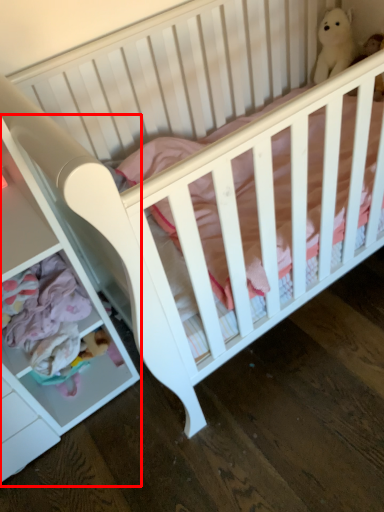
Question: From the image's perspective, what is the correct spatial positioning of dresser (annotated by the red box) in reference to figurine?

Choices:
 (A) above
 (B) below

Answer: (B)